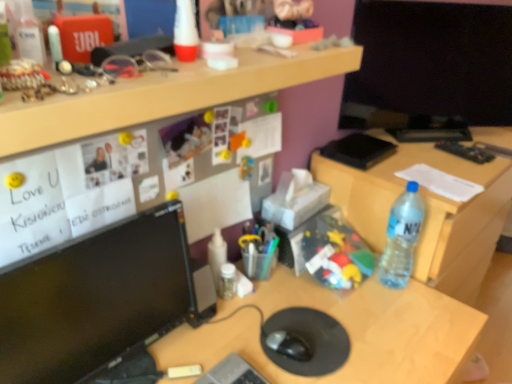
Where is `vacant area that lies to the right of translucent plastic bottle at center, which is the 1th bottle from left to right`? The width and height of the screenshot is (512, 384). vacant area that lies to the right of translucent plastic bottle at center, which is the 1th bottle from left to right is located at coordinates (280, 291).